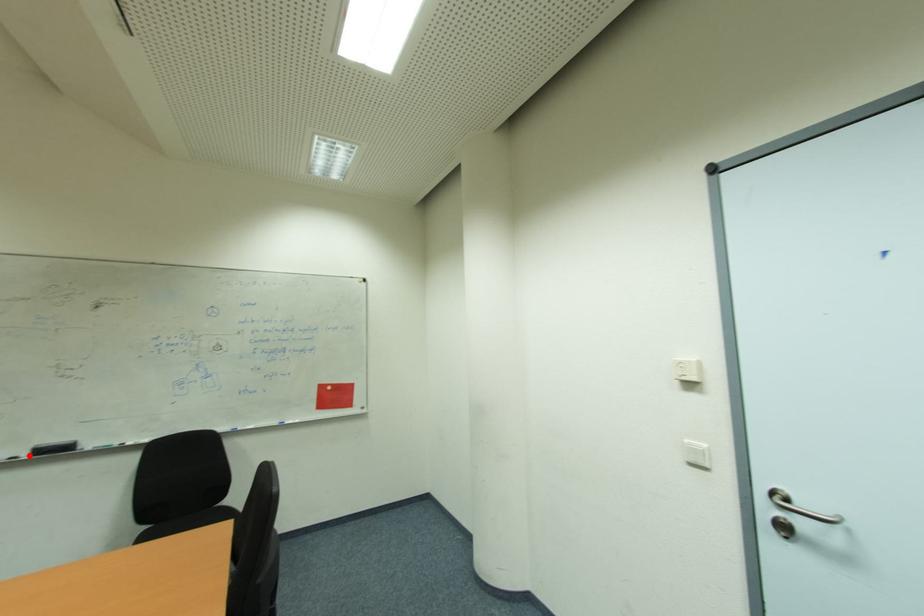
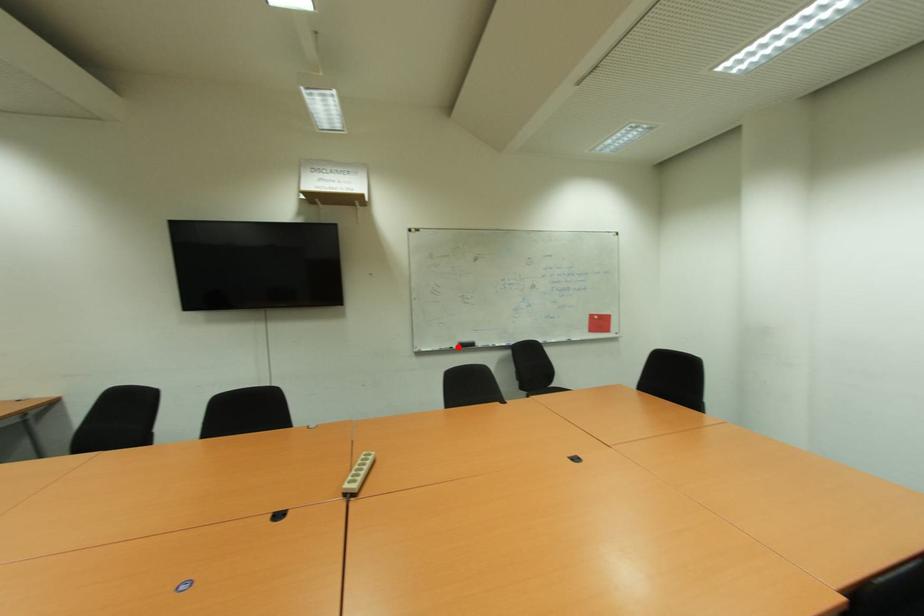
I am providing you with two images of the same scene from different viewpoints. A red point is marked on the first image and another point is marked on the second image. Is the red point in image1 aligned with the point shown in image2?

Yes